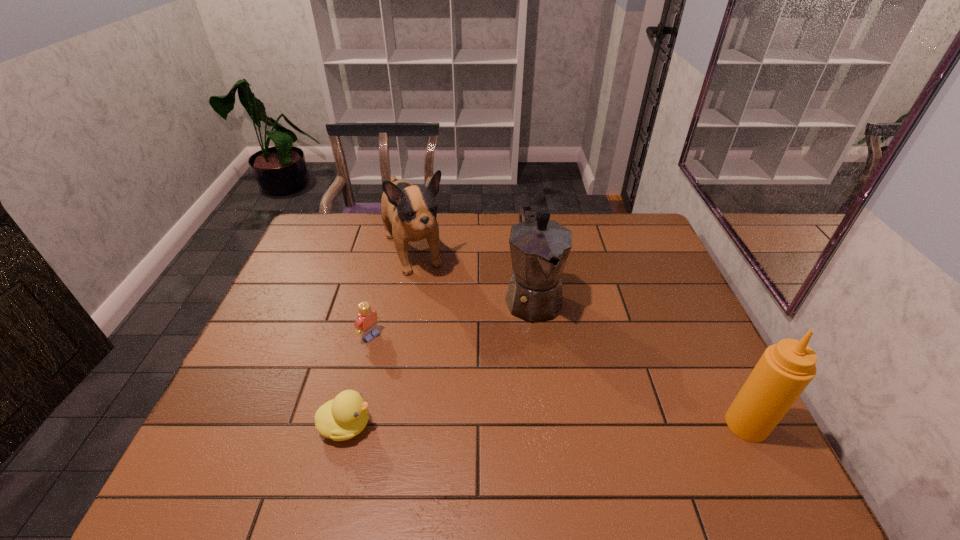
I want to click on object located at the near right corner, so click(785, 369).

Find the location of a particular element. vacant space at the far edge of the desktop is located at coordinates (390, 241).

This screenshot has height=540, width=960. I want to click on free region at the near edge, so click(660, 436).

Identify the location of free space at the left edge. (300, 283).

Where is `free space at the right edge`? This screenshot has width=960, height=540. free space at the right edge is located at coordinates (653, 262).

The width and height of the screenshot is (960, 540). I want to click on blank space at the far left corner of the desktop, so click(x=328, y=224).

At what (x,y) coordinates should I click in order to perform the action: click on vacant space at the far right corner of the desktop. Please return your answer as a coordinate pair (x, y). The image size is (960, 540). Looking at the image, I should click on (622, 241).

This screenshot has height=540, width=960. What are the coordinates of `vacant area between the condiment and the puppy` in the screenshot? It's located at (580, 339).

This screenshot has height=540, width=960. Identify the location of free space between the coffeepot and the puppy. (473, 275).

Where is `free space between the Lego and the coffeepot`? free space between the Lego and the coffeepot is located at coordinates (452, 317).